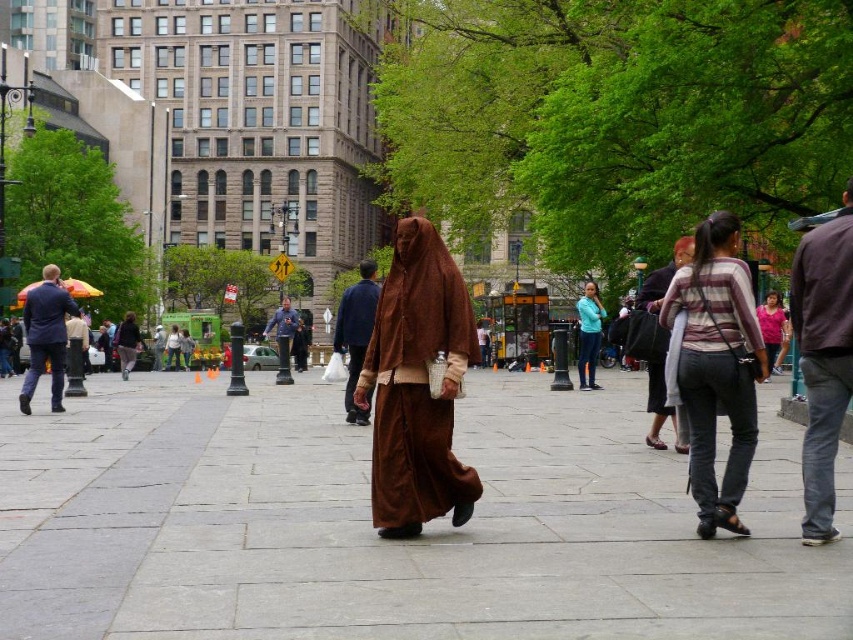
Is the position of dark brown leather jacket at right more distant than that of dark gray fabric pants at center?

No, it is not.

Between dark brown leather jacket at right and dark gray fabric pants at center, which one is positioned higher?

dark brown leather jacket at right

Locate an element on the screen. dark brown leather jacket at right is located at coordinates [822, 356].

Can you confirm if matte black statue at left is smaller than dark gray fabric pants at center?

Indeed, matte black statue at left has a smaller size compared to dark gray fabric pants at center.

Is matte black statue at left shorter than dark gray fabric pants at center?

Correct, matte black statue at left is not as tall as dark gray fabric pants at center.

This screenshot has height=640, width=853. I want to click on matte black statue at left, so click(x=76, y=355).

What do you see at coordinates (589, 336) in the screenshot? I see `teal fleece jacket at center` at bounding box center [589, 336].

Consider the image. Which of these two, teal fleece jacket at center or matte brown robe at center, stands shorter?

matte brown robe at center is shorter.

Who is more forward, [585,284] or [169,346]?

Point [169,346]

Locate an element on the screen. This screenshot has height=640, width=853. teal fleece jacket at center is located at coordinates (589, 336).